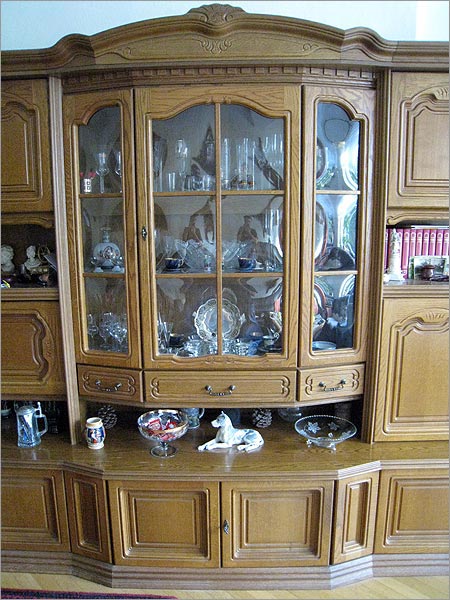
This screenshot has width=450, height=600. I want to click on glass, so click(x=246, y=157).